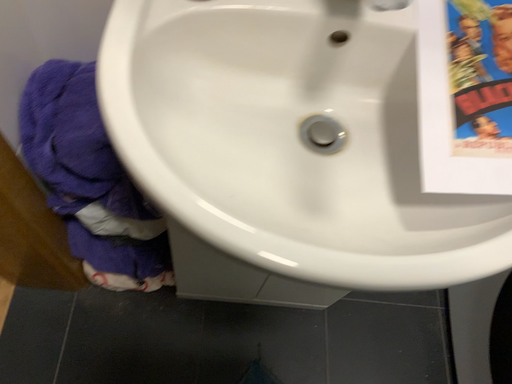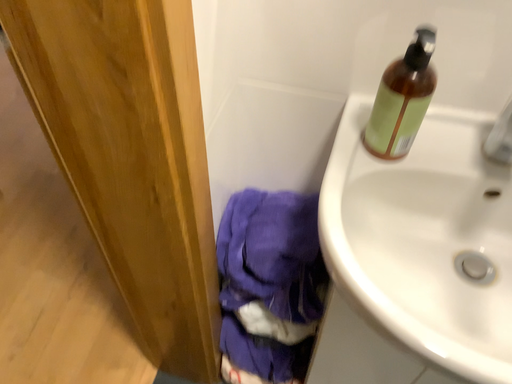
Question: Which way did the camera rotate in the video?

Choices:
 (A) rotated right
 (B) rotated left

Answer: (B)